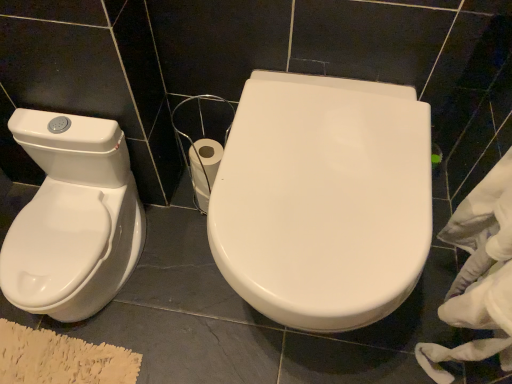
Describe the element at coordinates (72, 249) in the screenshot. I see `white glossy bidet at left` at that location.

Identify the location of white fabric at right. This screenshot has width=512, height=384. (479, 275).

Locate an element on the screen. white glossy bidet at left is located at coordinates (72, 249).

Is white glossy bidet at left positioned far away from white glossy toilet seat at center?

They are positioned close to each other.

Is white glossy bidet at left oriented away from white glossy toilet seat at center?

No, white glossy bidet at left is not facing the opposite direction of white glossy toilet seat at center.

Considering the relative sizes of white glossy bidet at left and white glossy toilet seat at center in the image provided, is white glossy bidet at left wider than white glossy toilet seat at center?

Incorrect, the width of white glossy bidet at left does not surpass that of white glossy toilet seat at center.

From a real-world perspective, which is physically above, white glossy toilet seat at center or white fabric at right?

white fabric at right.

Is white glossy toilet seat at center located outside white fabric at right?

white glossy toilet seat at center is positioned outside white fabric at right.

Between white glossy toilet seat at center and white fabric at right, which one is positioned behind?

white glossy toilet seat at center is further away from the camera.

In the scene shown: Based on their positions, is white glossy toilet seat at center located to the left or right of white fabric at right?

Clearly, white glossy toilet seat at center is on the left of white fabric at right in the image.

From the image's perspective, is white fabric at right above or below white glossy toilet seat at center?

Clearly, from the image's perspective, white fabric at right is below white glossy toilet seat at center.

Consider the image. Would you say white fabric at right is outside white glossy toilet seat at center?

Yes.

Where is `bidet that is below the white glossy toilet seat at center (from the image's perspective)`? bidet that is below the white glossy toilet seat at center (from the image's perspective) is located at coordinates (72, 249).

From the picture: Considering their positions, is white glossy toilet seat at center located in front of or behind white glossy bidet at left?

white glossy toilet seat at center is in front of white glossy bidet at left.

Who is bigger, white glossy toilet seat at center or white glossy bidet at left?

white glossy toilet seat at center is bigger.

From a real-world perspective, is white glossy toilet seat at center positioned under white glossy bidet at left based on gravity?

No, from a real-world perspective, white glossy toilet seat at center is not beneath white glossy bidet at left.

Does white glossy bidet at left have a greater width compared to white fabric at right?

Yes.

How different are the orientations of white glossy bidet at left and white fabric at right in degrees?

The angular difference between white glossy bidet at left and white fabric at right is 83.7 degrees.

Considering the relative sizes of white glossy bidet at left and white fabric at right in the image provided, is white glossy bidet at left taller than white fabric at right?

No.

Consider the image. Is white fabric at right positioned beyond the bounds of white glossy bidet at left?

white fabric at right is positioned outside white glossy bidet at left.

Looking at this image, from the image's perspective, who appears lower, white fabric at right or white glossy bidet at left?

white fabric at right is shown below in the image.

Is white fabric at right behind white glossy bidet at left?

No, the depth of white fabric at right is less than that of white glossy bidet at left.

How distant is white fabric at right from white glossy bidet at left?

white fabric at right is 31.72 inches away from white glossy bidet at left.

Locate an element on the screen. toilet in front of the white glossy bidet at left is located at coordinates (323, 199).

At what (x,y) coordinates should I click in order to perform the action: click on toilet below the white fabric at right (from a real-world perspective). Please return your answer as a coordinate pair (x, y). The width and height of the screenshot is (512, 384). Looking at the image, I should click on (323, 199).

From the image, which object appears to be nearer to white glossy toilet seat at center, white glossy bidet at left or white fabric at right?

Based on the image, white fabric at right appears to be nearer to white glossy toilet seat at center.

Looking at the image, which one is located closer to white fabric at right, white glossy toilet seat at center or white glossy bidet at left?

The object closer to white fabric at right is white glossy toilet seat at center.

Estimate the real-world distances between objects in this image. Which object is closer to white glossy toilet seat at center, white fabric at right or white glossy bidet at left?

Among the two, white fabric at right is located nearer to white glossy toilet seat at center.

From the image, which object appears to be nearer to white glossy bidet at left, white fabric at right or white glossy toilet seat at center?

white glossy toilet seat at center lies closer to white glossy bidet at left than the other object.

Based on their spatial positions, is white glossy bidet at left or white glossy toilet seat at center further from white fabric at right?

The object further to white fabric at right is white glossy bidet at left.

Which object lies further to the anchor point white glossy bidet at left, white glossy toilet seat at center or white fabric at right?

Among the two, white fabric at right is located further to white glossy bidet at left.

I want to click on toilet located between white glossy bidet at left and white fabric at right in the left-right direction, so click(323, 199).